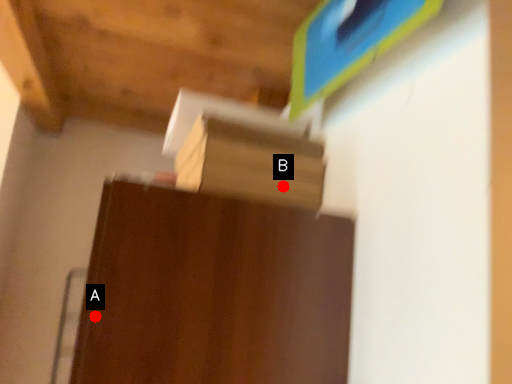
Question: Two points are circled on the image, labeled by A and B beside each circle. Which point is farther to the camera?

Choices:
 (A) A is further
 (B) B is further

Answer: (B)